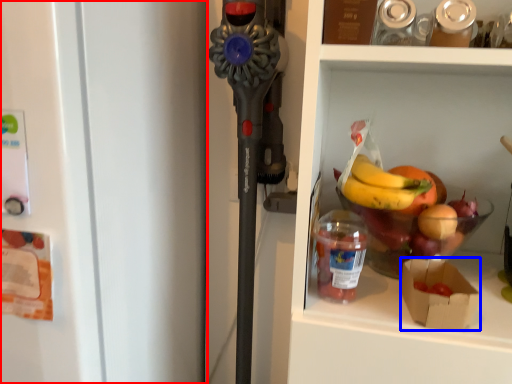
Question: Which object appears closest to the camera in this image, refrigerator (highlighted by a red box) or box (highlighted by a blue box)?

Choices:
 (A) refrigerator
 (B) box

Answer: (A)